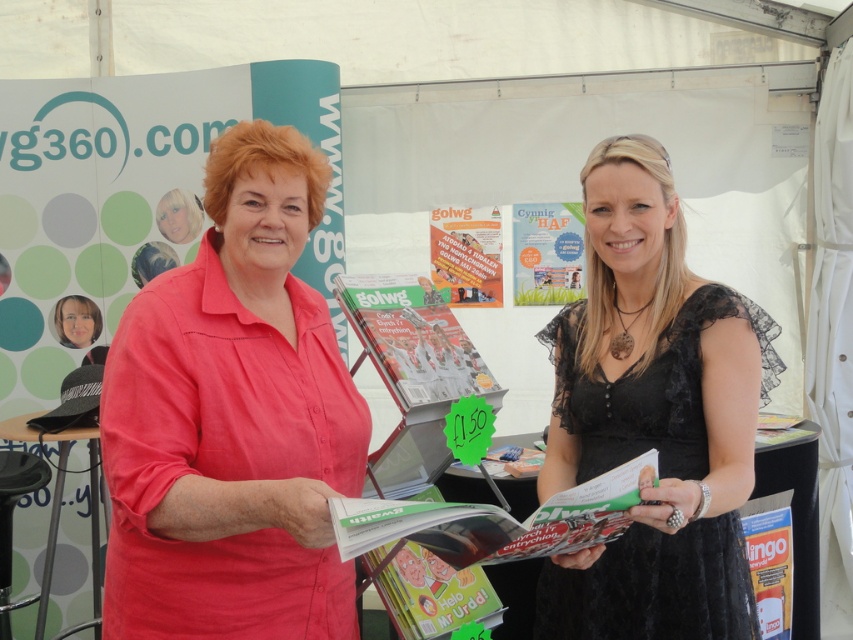
You are a photographer at the event and want to take a photo that includes both the point at (241, 179) and the point at (693, 556). Which point should you focus on first to ensure both are in focus?

You should focus on point (241, 179) first because it is closer to the camera than point (693, 556). By focusing on the closer point, the farther point will also be within the depth of field.

You are a photographer at the event and need to position a light source so that it illuminates both the pink cotton shirt at center and the black lace dress at center without casting shadows on the banner behind them. Based on their positions, where should you place the light source relative to the subjects?

The pink cotton shirt at center is above the black lace dress at center, so placing the light source above the subjects would ensure both are illuminated and prevent shadows from falling on the banner behind them.

You are a photographer standing in front of the two women at the event. You want to take a photo that captures both the pink cotton shirt at center and the black lace dress at center in the same frame. Considering the camera you are using has a minimum focus distance of 20 inches, will you be able to take the photo without moving closer?

The pink cotton shirt at center and black lace dress at center are 21.30 inches apart from each other. Since the distance between them is greater than the camera minimum focus distance of 20 inches, you can take the photo without moving closer as the camera can focus on both subjects within that range.